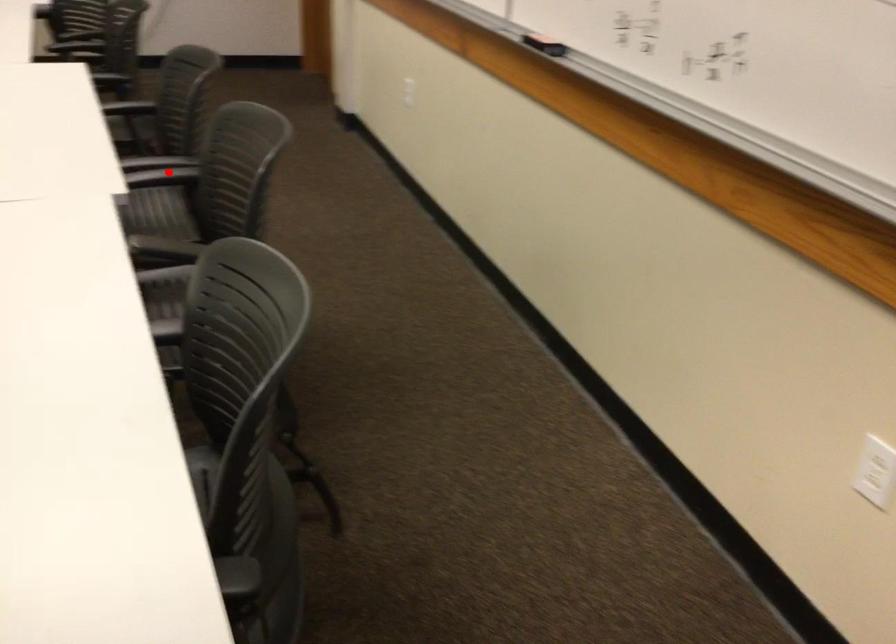
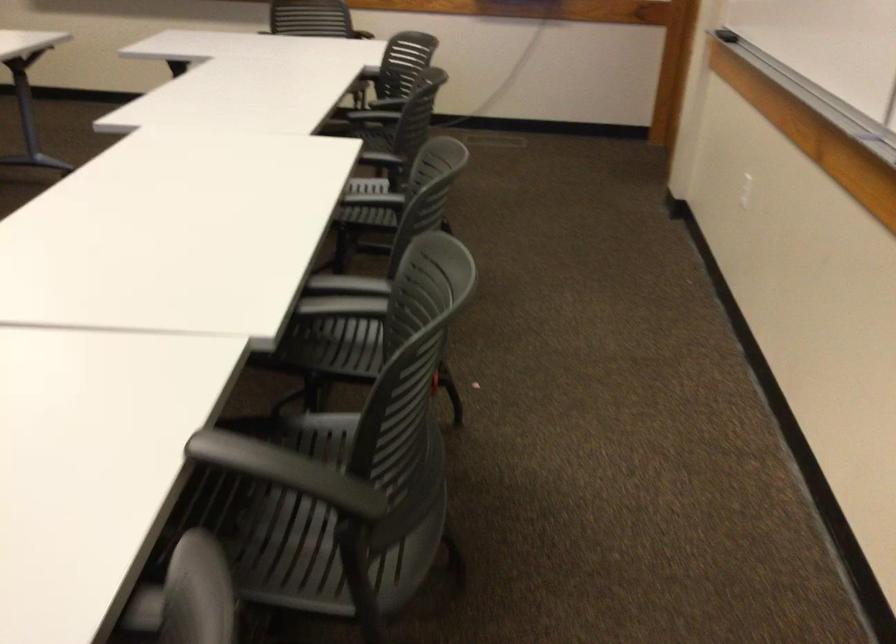
Question: A red point is marked in image1. In image2, is the corresponding 3D point closer to the camera or farther? Reply with the corresponding letter.

Choices:
 (A) The corresponding 3D point is closer.
 (B) The corresponding 3D point is farther.

Answer: (A)